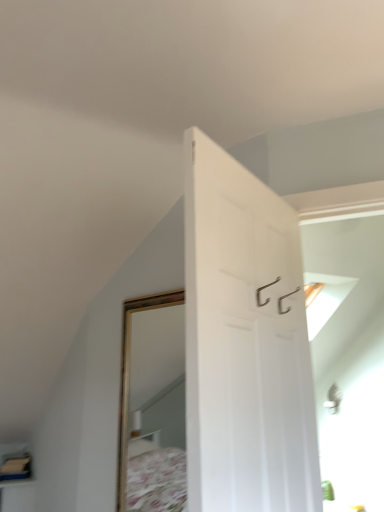
Question: Should I look upward or downward to see white matte door at center?

Choices:
 (A) down
 (B) up

Answer: (A)

Question: Is white matte door at center in front of wooden shelf at lower left?

Choices:
 (A) yes
 (B) no

Answer: (A)

Question: Is white matte door at center at the right side of wooden shelf at lower left?

Choices:
 (A) yes
 (B) no

Answer: (A)

Question: From a real-world perspective, is white matte door at center located higher than wooden shelf at lower left?

Choices:
 (A) no
 (B) yes

Answer: (B)

Question: Is white matte door at center aimed at wooden shelf at lower left?

Choices:
 (A) yes
 (B) no

Answer: (B)

Question: Would you say white matte door at center is outside wooden shelf at lower left?

Choices:
 (A) no
 (B) yes

Answer: (B)

Question: Is white matte door at center further to the viewer compared to wooden shelf at lower left?

Choices:
 (A) yes
 (B) no

Answer: (B)

Question: From a real-world perspective, is wooden shelf at lower left physically above white matte door at center?

Choices:
 (A) yes
 (B) no

Answer: (B)

Question: Does wooden shelf at lower left lie behind white matte door at center?

Choices:
 (A) no
 (B) yes

Answer: (B)

Question: From a real-world perspective, is wooden shelf at lower left beneath white matte door at center?

Choices:
 (A) no
 (B) yes

Answer: (B)

Question: Is wooden shelf at lower left closer to the viewer compared to white matte door at center?

Choices:
 (A) no
 (B) yes

Answer: (A)

Question: Is wooden shelf at lower left thinner than white matte door at center?

Choices:
 (A) no
 (B) yes

Answer: (A)

Question: Is white matte door at center completely or partially inside wooden shelf at lower left?

Choices:
 (A) yes
 (B) no

Answer: (B)

Question: In terms of width, does white matte door at center look wider or thinner when compared to wooden shelf at lower left?

Choices:
 (A) thin
 (B) wide

Answer: (A)